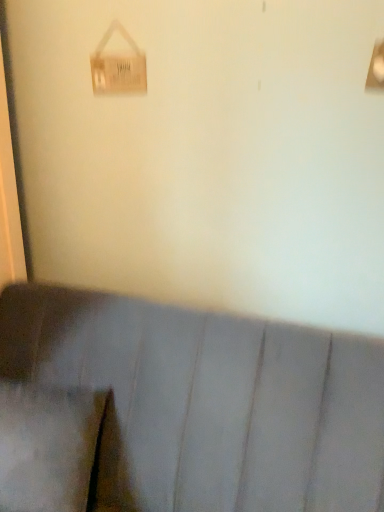
This screenshot has width=384, height=512. What do you see at coordinates (209, 401) in the screenshot?
I see `suede-like gray couch at lower center` at bounding box center [209, 401].

Locate an element on the screen. The image size is (384, 512). suede-like gray couch at lower center is located at coordinates (209, 401).

Consider the image. Is suede-like gray couch at lower center touching suede-like gray pillow at lower left?

They are not placed beside each other.

In terms of width, does suede-like gray couch at lower center look wider or thinner when compared to suede-like gray pillow at lower left?

suede-like gray couch at lower center is wider than suede-like gray pillow at lower left.

From a real-world perspective, does suede-like gray couch at lower center sit lower than suede-like gray pillow at lower left?

Yes, from a real-world perspective, suede-like gray couch at lower center is below suede-like gray pillow at lower left.

How different are the orientations of suede-like gray couch at lower center and suede-like gray pillow at lower left in degrees?

suede-like gray couch at lower center and suede-like gray pillow at lower left are facing 0.000231 degrees away from each other.

Is suede-like gray couch at lower center wider or thinner than wooden sign at upper left?

suede-like gray couch at lower center is wider than wooden sign at upper left.

Are suede-like gray couch at lower center and wooden sign at upper left beside each other?

suede-like gray couch at lower center and wooden sign at upper left are clearly separated.

From a real-world perspective, which object stands above the other?

wooden sign at upper left.

Is suede-like gray couch at lower center in front of or behind wooden sign at upper left in the image?

Visually, suede-like gray couch at lower center is located in front of wooden sign at upper left.

Is suede-like gray pillow at lower left oriented away from suede-like gray couch at lower center?

Yes.

Identify the location of furniture below the suede-like gray pillow at lower left (from the image's perspective). The height and width of the screenshot is (512, 384). (209, 401).

Which is correct: suede-like gray pillow at lower left is inside suede-like gray couch at lower center, or outside of it?

suede-like gray pillow at lower left fits inside suede-like gray couch at lower center.

Is the depth of suede-like gray pillow at lower left greater than that of suede-like gray couch at lower center?

Yes, it is.

From a real-world perspective, is suede-like gray pillow at lower left located beneath wooden sign at upper left?

Yes, from a real-world perspective, suede-like gray pillow at lower left is beneath wooden sign at upper left.

Which is further, [55,442] or [110,73]?

The point [110,73] is behind.

Is suede-like gray pillow at lower left shorter than wooden sign at upper left?

No.

How different are the orientations of suede-like gray pillow at lower left and wooden sign at upper left in degrees?

There is a 0.556-degree angle between the facing directions of suede-like gray pillow at lower left and wooden sign at upper left.

From a real-world perspective, is wooden sign at upper left beneath suede-like gray couch at lower center?

No.

Is wooden sign at upper left aimed at suede-like gray couch at lower center?

No, wooden sign at upper left is not oriented towards suede-like gray couch at lower center.

How distant is wooden sign at upper left from suede-like gray couch at lower center?

Answer: The distance of wooden sign at upper left from suede-like gray couch at lower center is 34.77 inches.

Can you tell me how much wooden sign at upper left and suede-like gray pillow at lower left differ in facing direction?

They differ by 0.556 degrees in their facing directions.

Does point (137, 55) lie behind point (69, 396)?

Yes, it is behind point (69, 396).

Is wooden sign at upper left not inside suede-like gray pillow at lower left?

wooden sign at upper left lies outside suede-like gray pillow at lower left's area.

From a real-world perspective, is wooden sign at upper left on suede-like gray pillow at lower left?

Correct, in the physical world, wooden sign at upper left is higher than suede-like gray pillow at lower left.

Find the location of `furniture below the suede-like gray pillow at lower left (from the image's perspective)`. furniture below the suede-like gray pillow at lower left (from the image's perspective) is located at coordinates (209, 401).

Locate an element on the screen. The image size is (384, 512). furniture in front of the wooden sign at upper left is located at coordinates (209, 401).

From the image, which object appears to be farther from suede-like gray pillow at lower left, suede-like gray couch at lower center or wooden sign at upper left?

wooden sign at upper left.

Based on their spatial positions, is suede-like gray couch at lower center or suede-like gray pillow at lower left further from wooden sign at upper left?

Based on the image, suede-like gray pillow at lower left appears to be further to wooden sign at upper left.

Considering their positions, is wooden sign at upper left positioned further to suede-like gray couch at lower center than suede-like gray pillow at lower left?

wooden sign at upper left.

Based on their spatial positions, is wooden sign at upper left or suede-like gray couch at lower center closer to suede-like gray pillow at lower left?

The object closer to suede-like gray pillow at lower left is suede-like gray couch at lower center.

Considering their positions, is suede-like gray pillow at lower left positioned further to suede-like gray couch at lower center than wooden sign at upper left?

wooden sign at upper left is further to suede-like gray couch at lower center.

Looking at the image, which one is located further to wooden sign at upper left, suede-like gray pillow at lower left or suede-like gray couch at lower center?

suede-like gray pillow at lower left.

This screenshot has width=384, height=512. I want to click on pillow that lies between wooden sign at upper left and suede-like gray couch at lower center from top to bottom, so click(x=47, y=446).